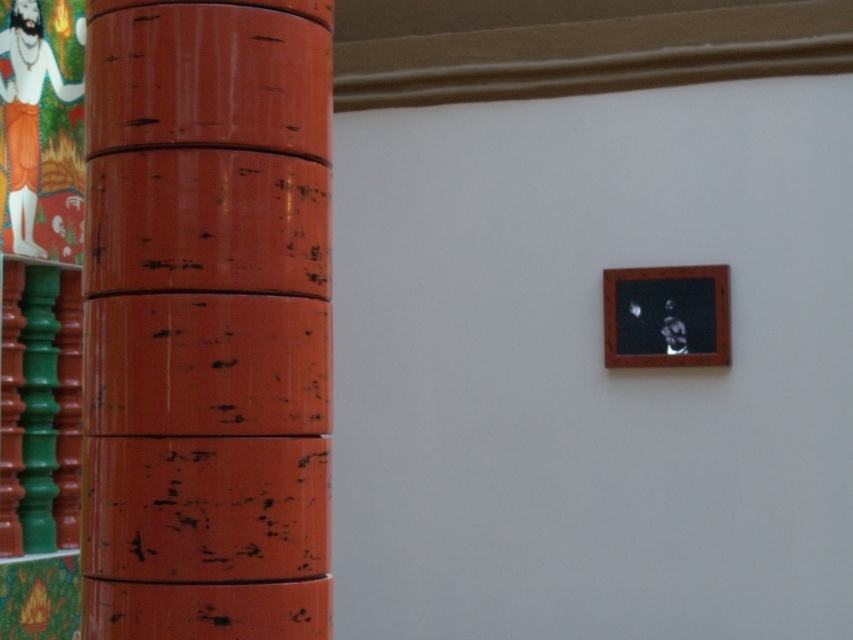
Which is more to the right, scratched orange pillar at left or wooden frame at upper right?

wooden frame at upper right

From the picture: Which is more to the left, scratched orange pillar at left or wooden frame at upper right?

From the viewer's perspective, scratched orange pillar at left appears more on the left side.

The image size is (853, 640). In order to click on scratched orange pillar at left in this screenshot , I will do `click(207, 320)`.

Image resolution: width=853 pixels, height=640 pixels. I want to click on scratched orange pillar at left, so pyautogui.click(x=207, y=320).